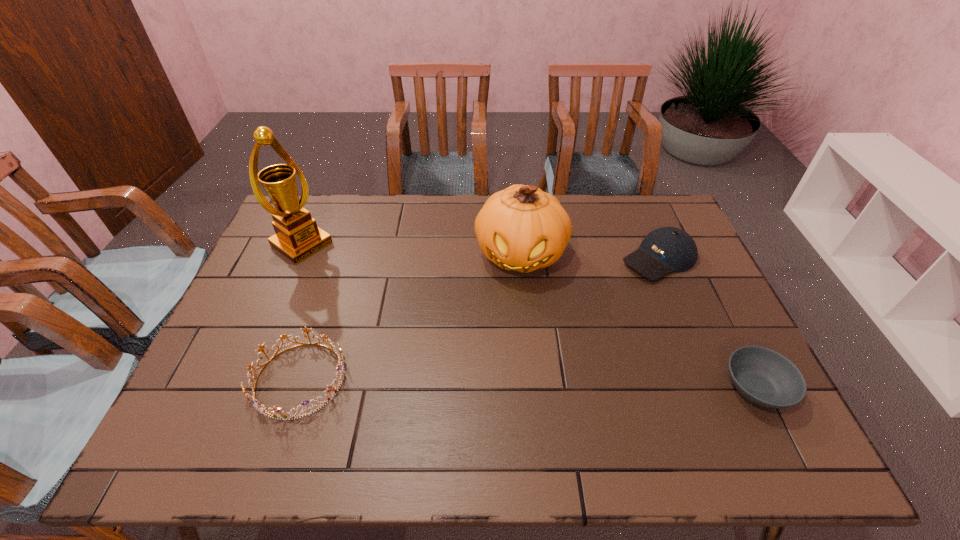
The image size is (960, 540). What are the coordinates of `vacant area that lies between the award and the baseball cap` in the screenshot? It's located at (480, 252).

Identify the location of unoccupied position between the third object from right to left and the second shortest object. The width and height of the screenshot is (960, 540). pos(410,318).

In order to click on vacant area that lies between the baseball cap and the second tallest object in this screenshot , I will do `click(589, 257)`.

The height and width of the screenshot is (540, 960). Identify the location of free space between the award and the third object from right to left. (411, 249).

Identify which object is located as the fourth nearest to the baseball cap. Please provide its 2D coordinates. Your answer should be formatted as a tuple, i.e. [(x, y)], where the tuple contains the x and y coordinates of a point satisfying the conditions above.

[(297, 237)]

Image resolution: width=960 pixels, height=540 pixels. I want to click on object that stands as the third closest to the award, so click(667, 249).

In order to click on vacant region that satisfies the following two spatial constraints: 1. on the front side of the shortest object; 2. on the right side of the award in this screenshot , I will do `click(239, 388)`.